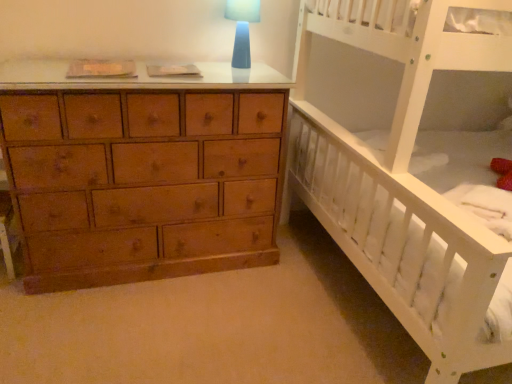
Question: Does white wooden bunk bed at right lie in front of blue glass lampshade at upper center?

Choices:
 (A) yes
 (B) no

Answer: (A)

Question: Is there a large distance between white wooden bunk bed at right and blue glass lampshade at upper center?

Choices:
 (A) no
 (B) yes

Answer: (A)

Question: Is white wooden bunk bed at right to the right of blue glass lampshade at upper center from the viewer's perspective?

Choices:
 (A) yes
 (B) no

Answer: (A)

Question: From the image's perspective, is white wooden bunk bed at right on blue glass lampshade at upper center?

Choices:
 (A) yes
 (B) no

Answer: (B)

Question: From a real-world perspective, is white wooden bunk bed at right physically below blue glass lampshade at upper center?

Choices:
 (A) yes
 (B) no

Answer: (A)

Question: Can we say white wooden bunk bed at right lies outside blue glass lampshade at upper center?

Choices:
 (A) no
 (B) yes

Answer: (B)

Question: Does blue glass lampshade at upper center come behind white wooden bunk bed at right?

Choices:
 (A) no
 (B) yes

Answer: (B)

Question: From a real-world perspective, is blue glass lampshade at upper center located beneath white wooden bunk bed at right?

Choices:
 (A) yes
 (B) no

Answer: (B)

Question: Could white wooden bunk bed at right be considered to be inside blue glass lampshade at upper center?

Choices:
 (A) yes
 (B) no

Answer: (B)

Question: Is blue glass lampshade at upper center not near white wooden bunk bed at right?

Choices:
 (A) no
 (B) yes

Answer: (A)

Question: Can we say blue glass lampshade at upper center lies outside white wooden bunk bed at right?

Choices:
 (A) no
 (B) yes

Answer: (B)

Question: Does blue glass lampshade at upper center have a larger size compared to white wooden bunk bed at right?

Choices:
 (A) no
 (B) yes

Answer: (A)

Question: From a real-world perspective, relative to white wooden bunk bed at right, is blue glass lampshade at upper center vertically above or below?

Choices:
 (A) above
 (B) below

Answer: (A)